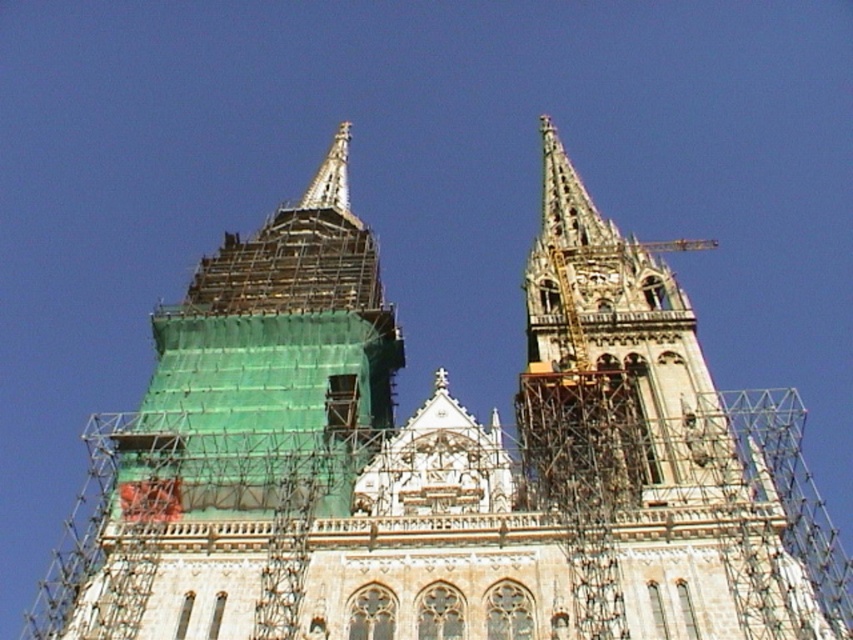
Question: Is stone spire at upper center further to the viewer compared to silver metallic spire at upper center?

Choices:
 (A) no
 (B) yes

Answer: (A)

Question: Among these points, which one is farthest from the camera?

Choices:
 (A) (801, 577)
 (B) (303, 205)

Answer: (B)

Question: Does stone spire at upper center have a smaller size compared to silver metallic spire at upper center?

Choices:
 (A) no
 (B) yes

Answer: (A)

Question: Which point is closer to the camera?

Choices:
 (A) stone spire at upper center
 (B) silver metallic spire at upper center

Answer: (A)

Question: Can you confirm if stone spire at upper center is positioned to the left of silver metallic spire at upper center?

Choices:
 (A) no
 (B) yes

Answer: (A)

Question: Which object is closer to the camera taking this photo?

Choices:
 (A) stone spire at upper center
 (B) silver metallic spire at upper center

Answer: (A)